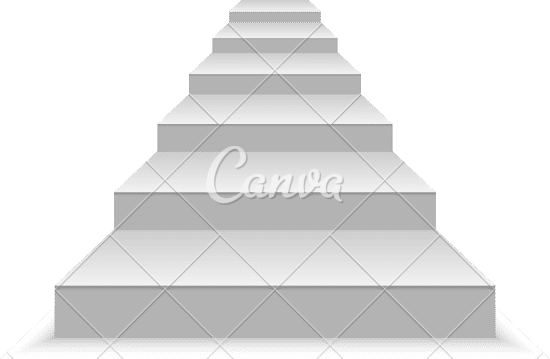
Locate an element on the screen. stairs is located at coordinates (278, 7), (280, 35), (254, 66), (287, 102), (300, 160), (214, 246).